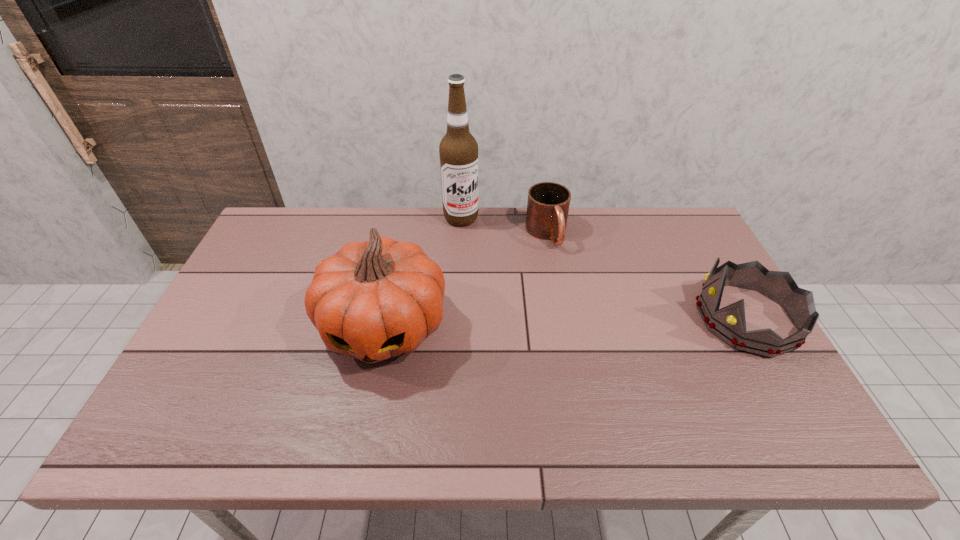
At what (x,y) coordinates should I click in order to perform the action: click on blank area at the far edge. Please return your answer as a coordinate pair (x, y). The image size is (960, 540). Looking at the image, I should click on (617, 236).

In the image, there is a desktop. Where is `free space at the near edge`? free space at the near edge is located at coordinates point(548,397).

Image resolution: width=960 pixels, height=540 pixels. What are the coordinates of `vacant space at the left edge` in the screenshot? It's located at (252, 278).

At what (x,y) coordinates should I click in order to perform the action: click on free region at the right edge of the desktop. Please return your answer as a coordinate pair (x, y). The width and height of the screenshot is (960, 540). Looking at the image, I should click on (677, 292).

The image size is (960, 540). What are the coordinates of `free space at the far left corner of the desktop` in the screenshot? It's located at (266, 249).

What are the coordinates of `free space at the far right corner` in the screenshot? It's located at (689, 224).

Image resolution: width=960 pixels, height=540 pixels. I want to click on free spot between the third shortest object and the shortest object, so click(466, 280).

Image resolution: width=960 pixels, height=540 pixels. What are the coordinates of `blank region between the tallest object and the rightmost object` in the screenshot? It's located at (604, 268).

The height and width of the screenshot is (540, 960). What are the coordinates of `free space between the third object from left to right and the pumpkin` in the screenshot? It's located at [x=466, y=280].

This screenshot has width=960, height=540. What are the coordinates of `vacant space that's between the mug and the pumpkin` in the screenshot? It's located at (466, 280).